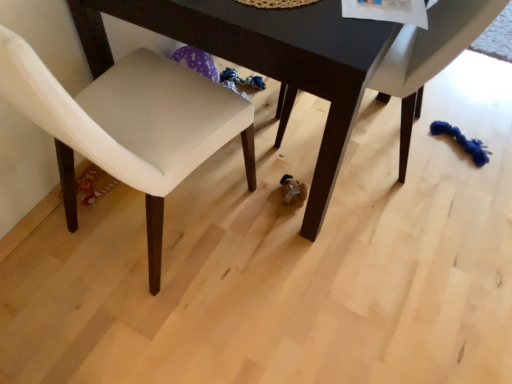
Find the location of `free point to the right of dark wood table at center`. free point to the right of dark wood table at center is located at coordinates (457, 158).